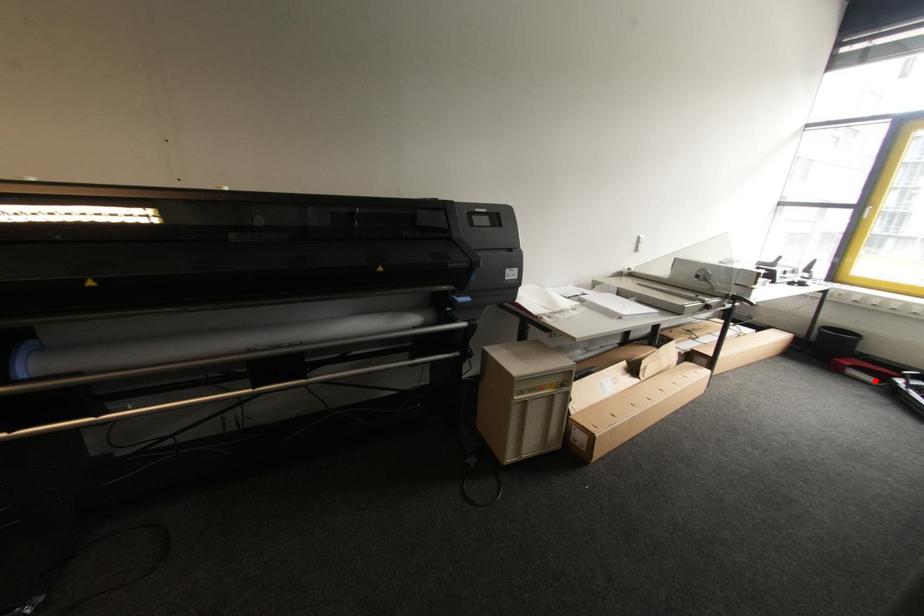
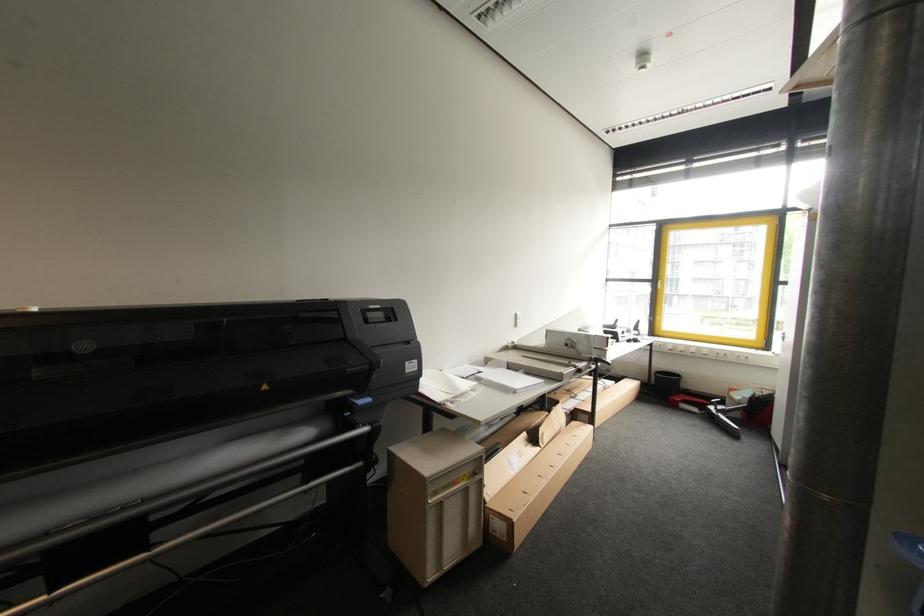
Question: I am providing you with two images of the same scene from different viewpoints. Image1 has a red point marked. In image2, the corresponding 3D location appears at what relative position? Reply with the corresponding letter.

Choices:
 (A) Closer
 (B) Farther

Answer: (A)